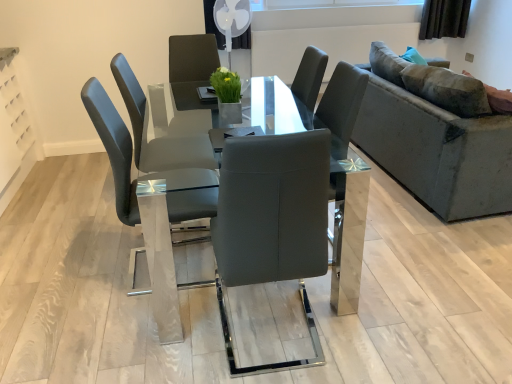
Question: Is matte gray chair at center not inside transparent glass table at center?

Choices:
 (A) yes
 (B) no

Answer: (B)

Question: Is transparent glass table at center inside matte gray chair at center?

Choices:
 (A) no
 (B) yes

Answer: (A)

Question: From a real-world perspective, is matte gray chair at center under transparent glass table at center?

Choices:
 (A) no
 (B) yes

Answer: (A)

Question: Is matte gray chair at center taller than transparent glass table at center?

Choices:
 (A) yes
 (B) no

Answer: (A)

Question: Does matte gray chair at center come in front of transparent glass table at center?

Choices:
 (A) no
 (B) yes

Answer: (A)

Question: From a real-world perspective, is transparent glass table at center positioned above or below velvet grey couch at right?

Choices:
 (A) above
 (B) below

Answer: (B)

Question: From the image's perspective, relative to velvet grey couch at right, is transparent glass table at center above or below?

Choices:
 (A) below
 (B) above

Answer: (A)

Question: Does point (352, 167) appear closer or farther from the camera than point (482, 215)?

Choices:
 (A) farther
 (B) closer

Answer: (A)

Question: Considering the positions of transparent glass table at center and velvet grey couch at right in the image, is transparent glass table at center bigger or smaller than velvet grey couch at right?

Choices:
 (A) small
 (B) big

Answer: (A)

Question: From the image's perspective, is matte gray chair at center above or below transparent glass table at center?

Choices:
 (A) above
 (B) below

Answer: (A)

Question: Visually, is matte gray chair at center positioned to the left or to the right of transparent glass table at center?

Choices:
 (A) left
 (B) right

Answer: (A)

Question: In terms of width, does matte gray chair at center look wider or thinner when compared to transparent glass table at center?

Choices:
 (A) wide
 (B) thin

Answer: (B)

Question: Is matte gray chair at center taller or shorter than transparent glass table at center?

Choices:
 (A) tall
 (B) short

Answer: (A)

Question: Considering their positions, is transparent glass table at center located in front of or behind matte gray chair at center?

Choices:
 (A) front
 (B) behind

Answer: (A)

Question: Would you say transparent glass table at center is to the left or to the right of matte gray chair at center in the picture?

Choices:
 (A) right
 (B) left

Answer: (A)